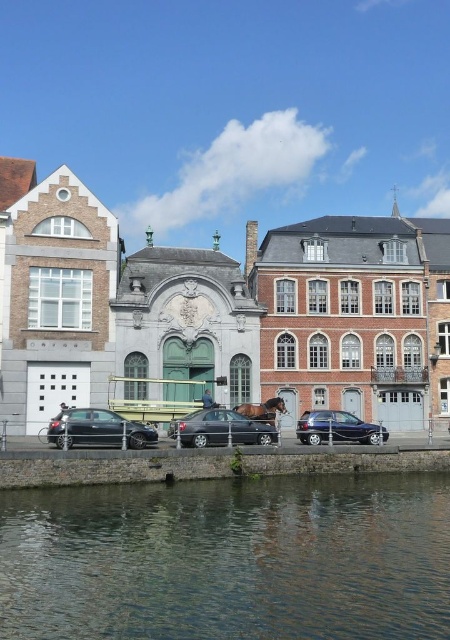
Does shiny silver sedan at center come behind brown glossy horse at center?

No, shiny silver sedan at center is closer to the viewer.

Which is above, shiny silver sedan at center or brown glossy horse at center?

brown glossy horse at center

Measure the distance between shiny silver sedan at center and camera.

They are 54.69 meters apart.

You are a GUI agent. You are given a task and a screenshot of the screen. Output one action in this format:
    pyautogui.click(x=<x>, y=<y>)
    Task: Click on the shiny silver sedan at center
    The width and height of the screenshot is (450, 640).
    Given the screenshot: What is the action you would take?
    pyautogui.click(x=220, y=428)

Based on the photo, between transparent water at lower center and satin black car at center, which one appears on the left side from the viewer's perspective?

Positioned to the left is transparent water at lower center.

Is point (220, 630) behind point (337, 420)?

No, it is in front of (337, 420).

Find the location of a particular element. The image size is (450, 640). transparent water at lower center is located at coordinates (229, 560).

Identify the location of shiny black sedan at lower left. [86, 428].